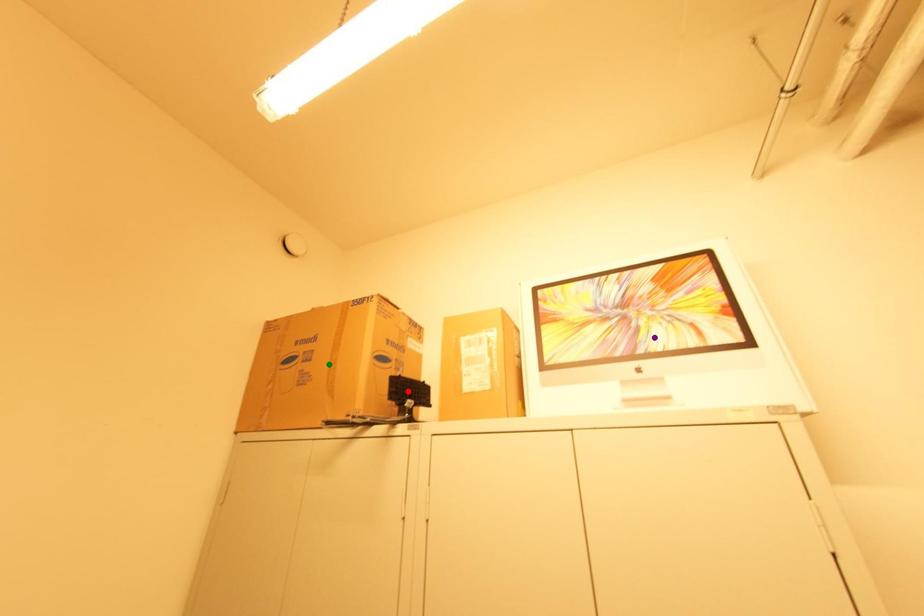
Order these from farthest to nearest:
1. green point
2. purple point
3. red point

green point, red point, purple point